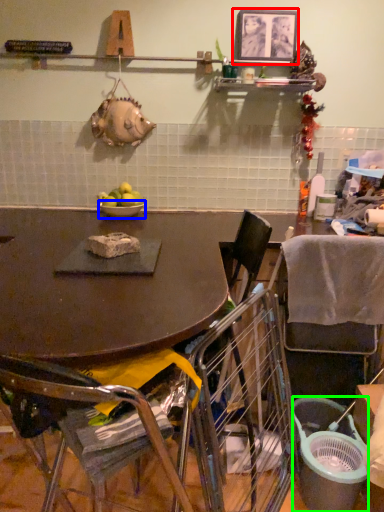
Question: Based on their relative distances, which object is farther from picture frame (highlighted by a red box)? Choose from bowl (highlighted by a blue box) and trash bin/can (highlighted by a green box).

Choices:
 (A) bowl
 (B) trash bin/can

Answer: (B)